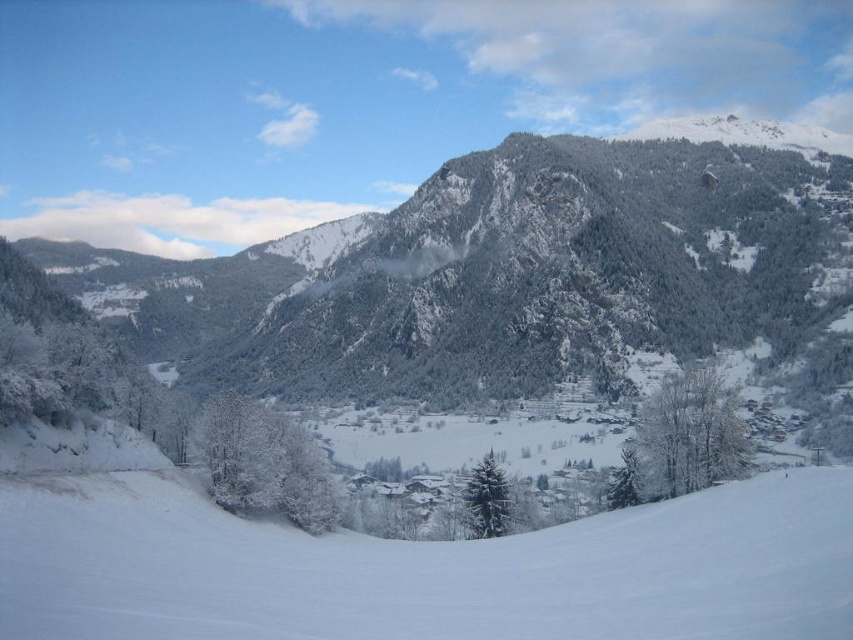
You are a skier planning to ski down the white snow ski slope at center. You want to know if you can reach the white frosty tree at lower right after skiing down. The minimum distance you need to cover to reach the tree is 35 meters. Can you make it?

The distance between the white snow ski slope at center and the white frosty tree at lower right is 40.28 meters, which is more than the 35 meters required. Therefore, you can reach the white frosty tree at lower right after skiing down.

You are planning to build a small cabin on the white snow ski slope at center or near the white frosty tree at lower right. Which location has more space to accommodate the cabin?

The white snow ski slope at center has a greater width than the white frosty tree at lower right, so building the cabin on the ski slope would provide more space.

Based on the photo, you are a hiker planning to take a photo of both the green textured mountain at center and the white snow ski slope at center. Since you want both to be clearly visible in the frame, which object should you position closer to the camera to ensure they appear similar in size?

The green textured mountain at center is bigger than the white snow ski slope at center. To make them appear similar in size in the photo, you should position the white snow ski slope at center closer to the camera since it is smaller.